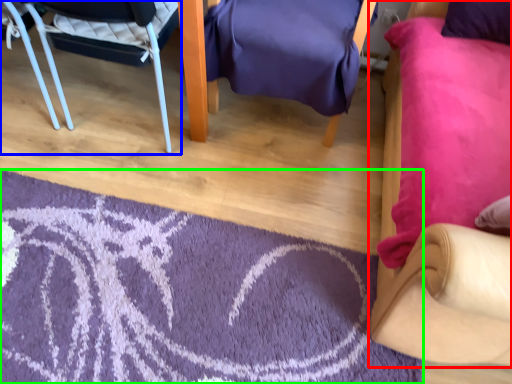
Question: Which object is positioned farthest from chair (highlighted by a red box)? Select from chair (highlighted by a blue box) and mat (highlighted by a green box).

Choices:
 (A) chair
 (B) mat

Answer: (A)